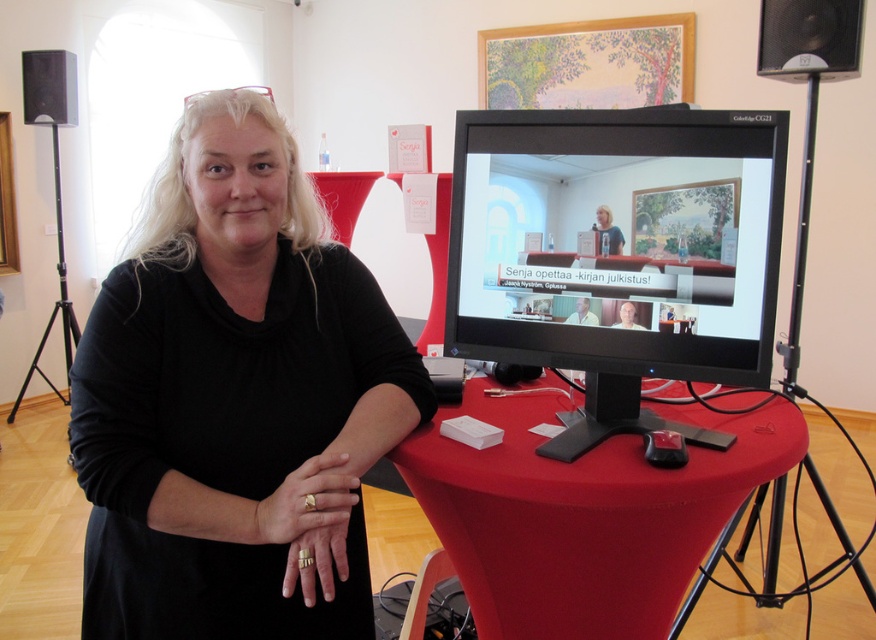
Which is more to the left, black matte dress at center or black plastic speaker at upper right?

black matte dress at center is more to the left.

Does black matte dress at center have a greater width compared to black plastic speaker at upper right?

Correct, the width of black matte dress at center exceeds that of black plastic speaker at upper right.

The image size is (876, 640). What do you see at coordinates (235, 401) in the screenshot? I see `black matte dress at center` at bounding box center [235, 401].

Identify the location of black matte dress at center. This screenshot has height=640, width=876. (235, 401).

Who is more forward, (x=244, y=275) or (x=733, y=348)?

Point (x=244, y=275) is in front.

Is the position of black matte dress at center more distant than that of matte black monitor at center?

No, it is in front of matte black monitor at center.

Is point (206, 250) in front of point (597, 109)?

Yes, it is in front of point (597, 109).

The height and width of the screenshot is (640, 876). Identify the location of black matte dress at center. (235, 401).

In order to click on matte black monitor at center in this screenshot , I will do `click(617, 240)`.